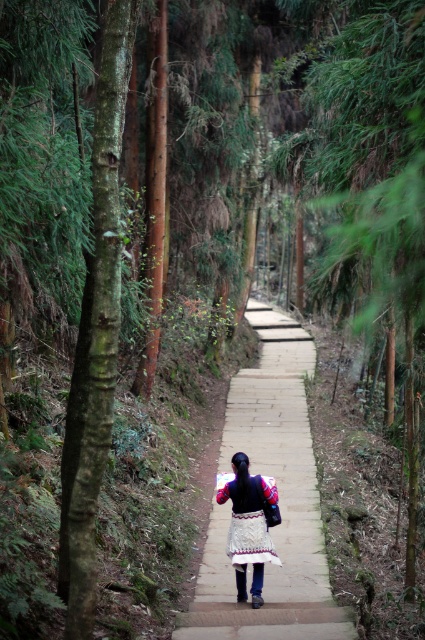
Question: Which object is closer to the camera taking this photo?

Choices:
 (A) white embroidered skirt at center
 (B) smooth concrete path at center
 (C) brown rough bark tree at left

Answer: (C)

Question: Which point appears closest to the camera in this image?

Choices:
 (A) [76, 577]
 (B) [240, 618]

Answer: (A)

Question: Which point is closer to the camera?

Choices:
 (A) (119, 84)
 (B) (272, 493)
 (C) (303, 636)

Answer: (A)

Question: Can you confirm if brown rough bark tree at left is bigger than white embroidered skirt at center?

Choices:
 (A) yes
 (B) no

Answer: (B)

Question: Does brown rough bark tree at left have a larger size compared to white embroidered skirt at center?

Choices:
 (A) yes
 (B) no

Answer: (B)

Question: Is smooth concrete path at center bigger than brown rough bark tree at left?

Choices:
 (A) no
 (B) yes

Answer: (B)